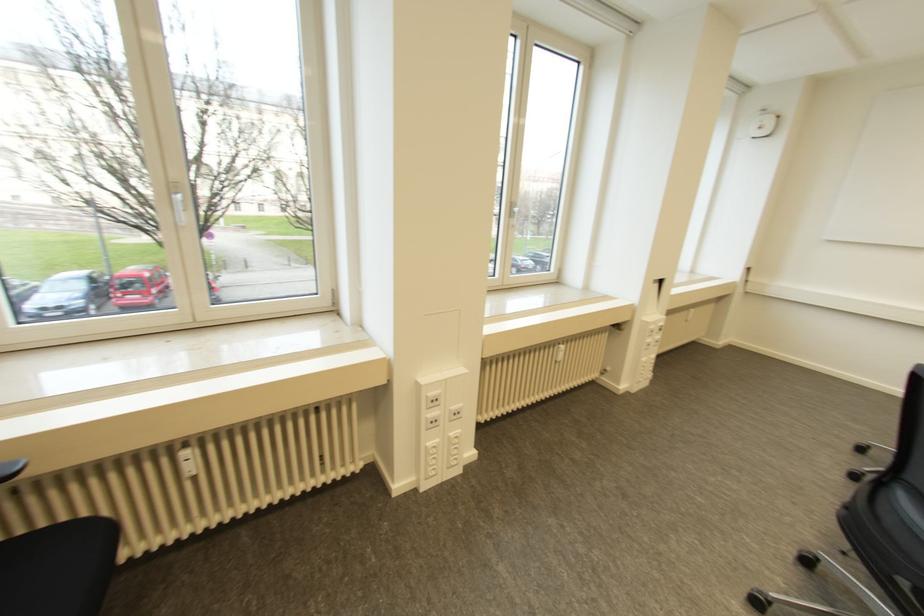
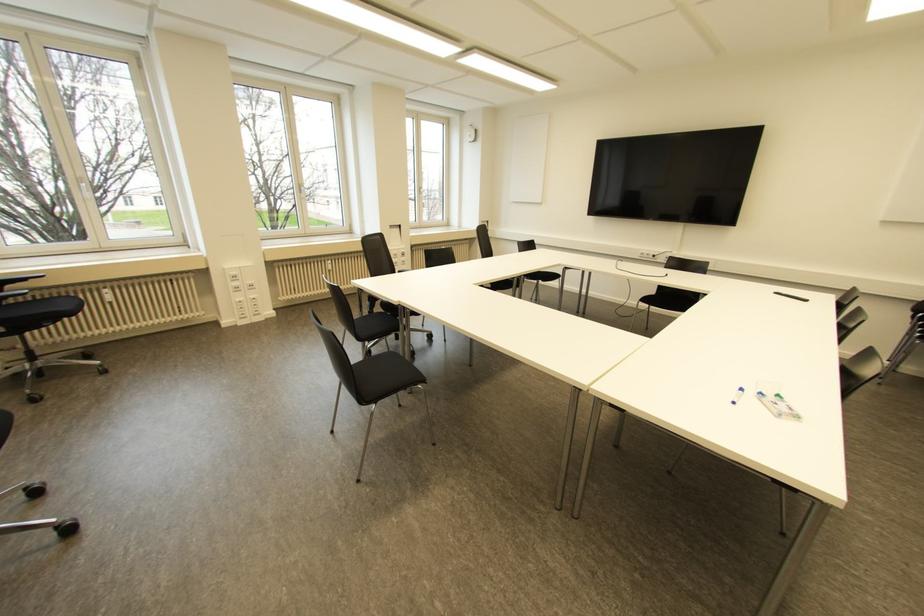
What movement of the cameraman would produce the second image?

The cameraman moved toward right, backward.